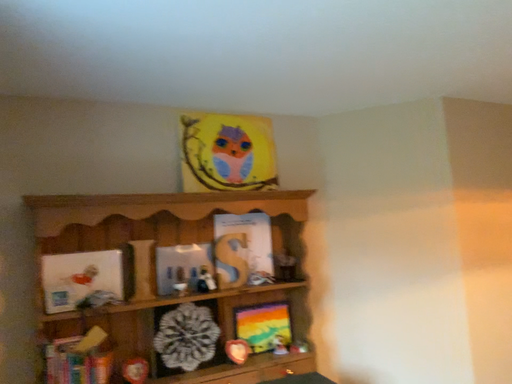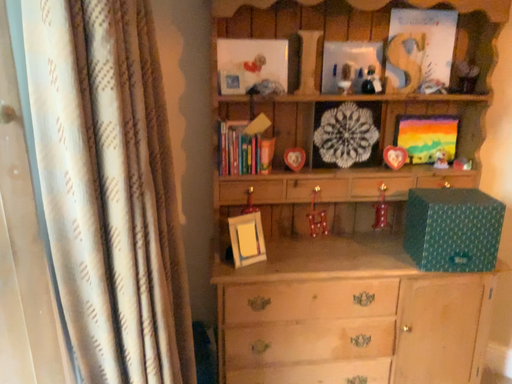
Question: How did the camera likely rotate when shooting the video?

Choices:
 (A) rotated left
 (B) rotated right

Answer: (A)